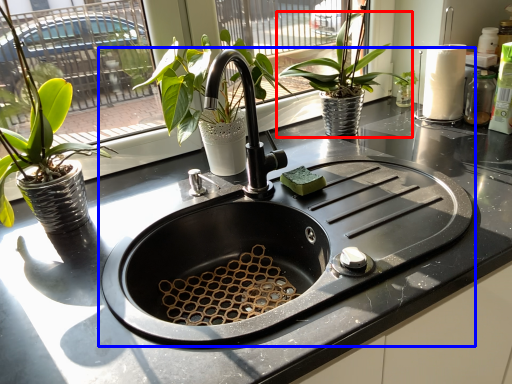
Question: Which object appears closest to the camera in this image, houseplant (highlighted by a red box) or sink (highlighted by a blue box)?

Choices:
 (A) houseplant
 (B) sink

Answer: (B)